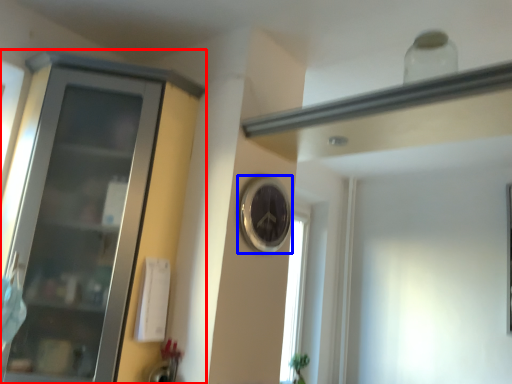
Question: Which object appears closest to the camera in this image, cupboard (highlighted by a red box) or clock (highlighted by a blue box)?

Choices:
 (A) cupboard
 (B) clock

Answer: (A)